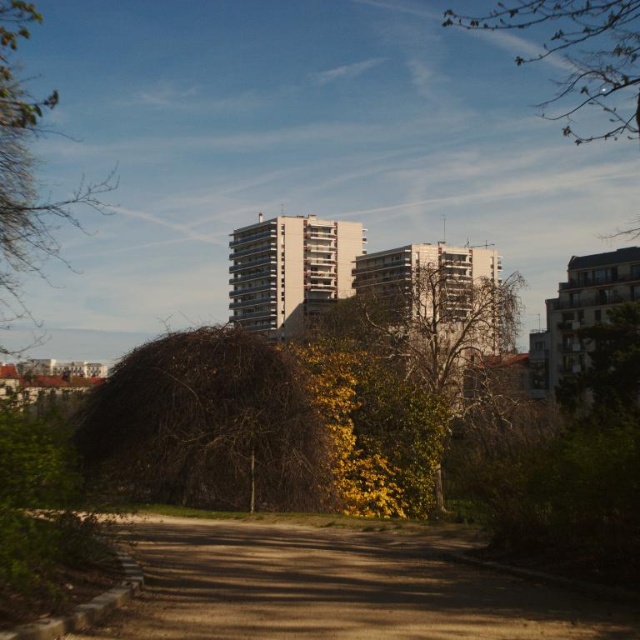
You are standing in the park and want to reach the point marked as point (163, 444). If your walking speed is 1.5 meters per second, how long will it take you to reach that point?

The distance between you and point (163, 444) is 19.07 meters. At a walking speed of 1.5 meters per second, it will take approximately 12.71 seconds to reach the point.

You are standing at the entrance of the park and want to find the brown dirt path at lower center. According to the scene description, where should you look relative to the entrance?

The brown dirt path at lower center is located at the lower center area of the scene, which would be directly ahead and slightly downward from the entrance.